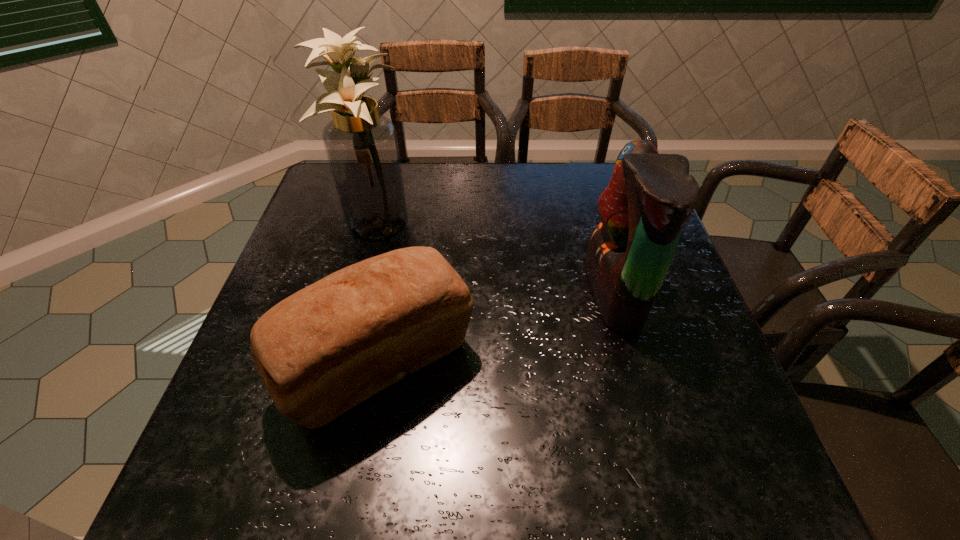
You are a GUI agent. You are given a task and a screenshot of the screen. Output one action in this format:
    pyautogui.click(x=<x>, y=<y>)
    Task: Click on the object present at the near edge
    This screenshot has width=960, height=540.
    Given the screenshot: What is the action you would take?
    pyautogui.click(x=328, y=347)

I want to click on flower arrangement present at the left edge, so pyautogui.click(x=361, y=145).

Find the location of a particular element. bread located in the left edge section of the desktop is located at coordinates (328, 347).

At what (x,y) coordinates should I click in order to perform the action: click on object at the right edge. Please return your answer as a coordinate pair (x, y). The height and width of the screenshot is (540, 960). Looking at the image, I should click on (650, 197).

The height and width of the screenshot is (540, 960). Identify the location of object at the far left corner. (361, 145).

Identify the location of object located at the near left corner. (328, 347).

Where is `vacant space at the far edge of the desktop`? vacant space at the far edge of the desktop is located at coordinates (484, 171).

You are a GUI agent. You are given a task and a screenshot of the screen. Output one action in this format:
    pyautogui.click(x=<x>, y=<y>)
    Task: Click on the free space at the left edge of the desktop
    Image resolution: width=960 pixels, height=540 pixels.
    Given the screenshot: What is the action you would take?
    pyautogui.click(x=313, y=256)

Identify the location of free space at the right edge of the desktop. (x=698, y=414).

In the image, there is a desktop. At what (x,y) coordinates should I click in order to perform the action: click on vacant space at the far right corner. Please return your answer as a coordinate pair (x, y). Image resolution: width=960 pixels, height=540 pixels. Looking at the image, I should click on (605, 170).